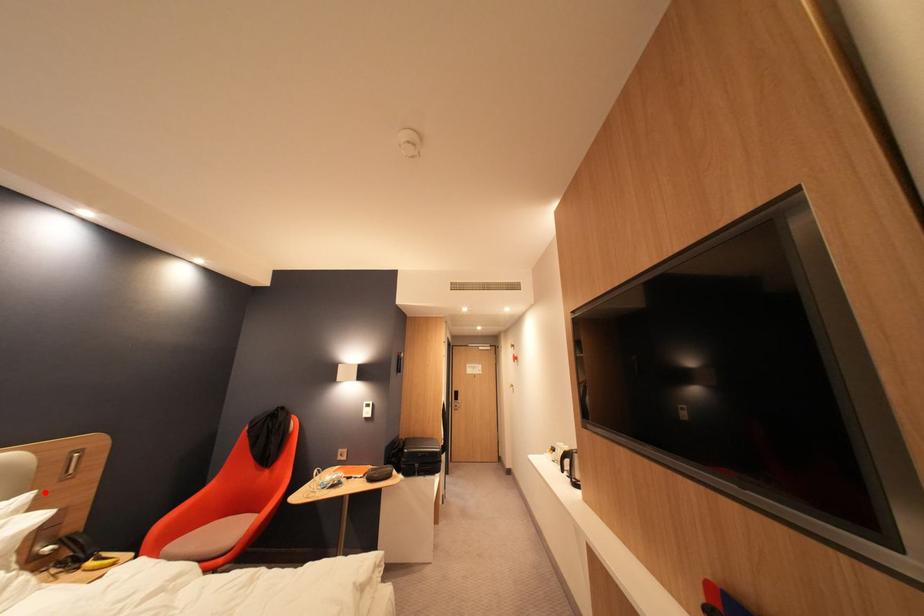
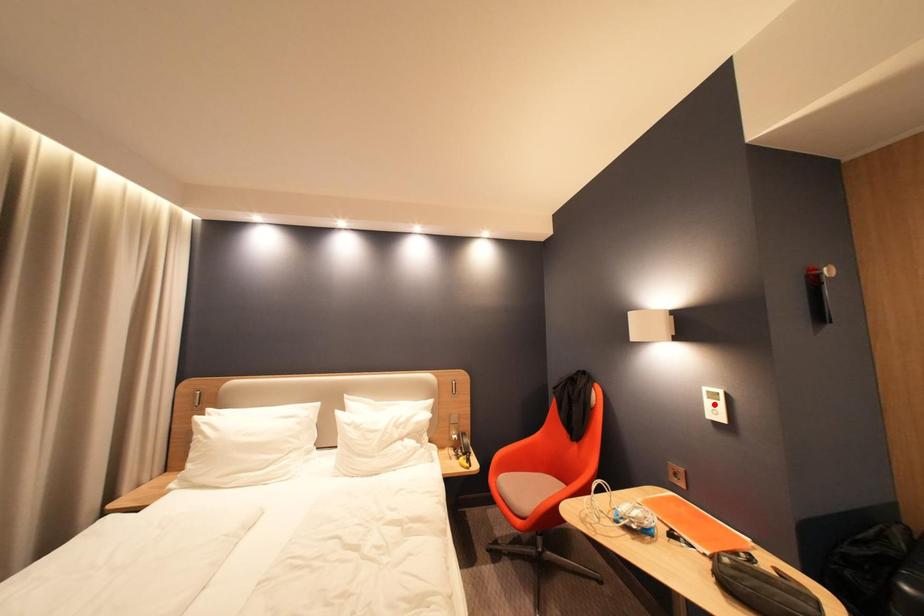
I am providing you with two images of the same scene from different viewpoints. A red point is marked on the first image and another point is marked on the second image. Is the red point in image1 aligned with the point shown in image2?

No